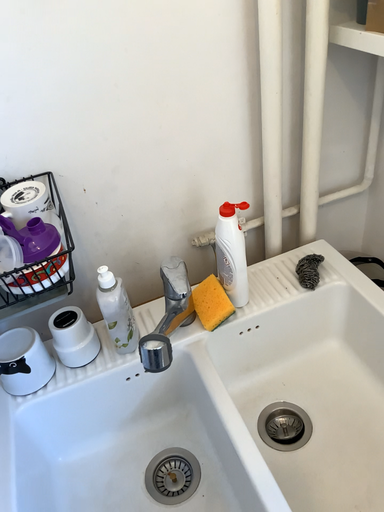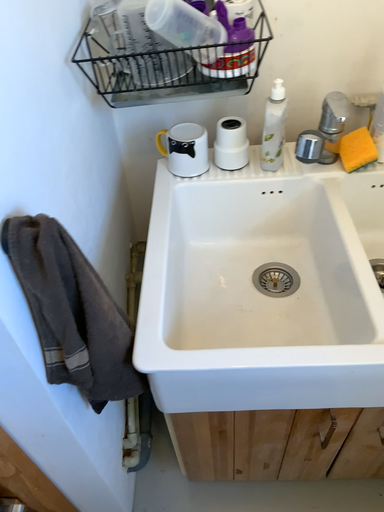
Question: How did the camera likely rotate when shooting the video?

Choices:
 (A) rotated upward
 (B) rotated downward

Answer: (B)